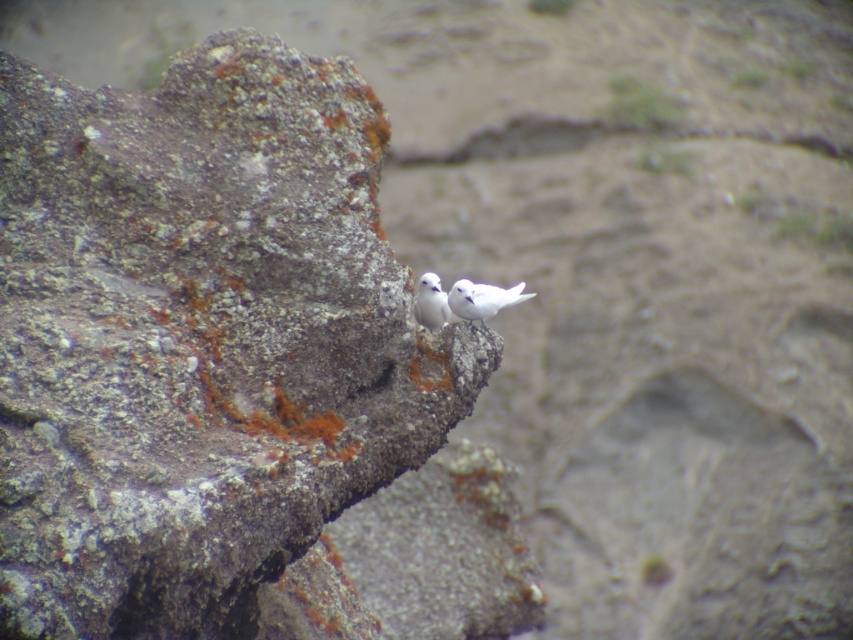
You are a photographer aiming to capture both the rusty stone boulder at center and the white matte bird at center in a single frame. Given that your camera has a depth of field that can sharply focus on objects within a 30 inch range, will both subjects be in focus simultaneously?

The rusty stone boulder at center is 34.33 inches away from the white matte bird at center. Since the distance between them exceeds the camera lens depth of field range of 30 inches, both subjects cannot be in focus at the same time.

You are a photographer trying to capture the two birds on the rocky surface. You notice two specific points on the rocks where you might place your tripod. The first point is at coordinates point (486, 305), and the second is at point (426, 323). Which point is closer to you where you can set up your tripod to get a better closeup shot of the birds?

Point (486, 305) is closer to the viewer than point (426, 323), so setting up the tripod there would allow for a better closeup shot of the birds.